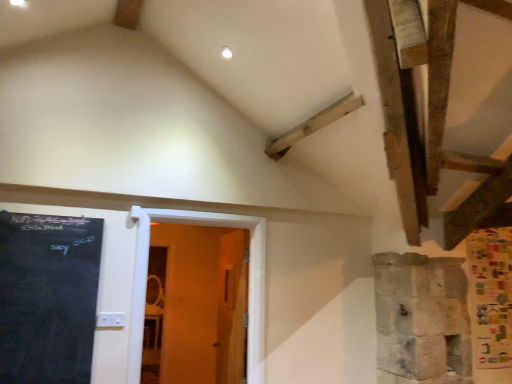
Question: Is wooden door at center facing towards black chalkboard at left?

Choices:
 (A) no
 (B) yes

Answer: (A)

Question: Considering the relative sizes of wooden door at center and black chalkboard at left in the image provided, is wooden door at center bigger than black chalkboard at left?

Choices:
 (A) yes
 (B) no

Answer: (A)

Question: Is wooden door at center oriented away from black chalkboard at left?

Choices:
 (A) yes
 (B) no

Answer: (B)

Question: Is black chalkboard at left located within wooden door at center?

Choices:
 (A) no
 (B) yes

Answer: (A)

Question: From a real-world perspective, is wooden door at center physically below black chalkboard at left?

Choices:
 (A) no
 (B) yes

Answer: (B)

Question: From the image's perspective, is wooden door at center on black chalkboard at left?

Choices:
 (A) no
 (B) yes

Answer: (A)

Question: Can you confirm if black chalkboard at left is thinner than wooden door at center?

Choices:
 (A) no
 (B) yes

Answer: (B)

Question: Is black chalkboard at left shorter than wooden door at center?

Choices:
 (A) yes
 (B) no

Answer: (A)

Question: Does black chalkboard at left touch wooden door at center?

Choices:
 (A) no
 (B) yes

Answer: (A)

Question: Is black chalkboard at left further to the viewer compared to wooden door at center?

Choices:
 (A) yes
 (B) no

Answer: (B)

Question: Considering the relative sizes of black chalkboard at left and wooden door at center in the image provided, is black chalkboard at left wider than wooden door at center?

Choices:
 (A) no
 (B) yes

Answer: (A)

Question: Would you say black chalkboard at left contains wooden door at center?

Choices:
 (A) no
 (B) yes

Answer: (A)

Question: Is point (49, 243) closer or farther from the camera than point (252, 263)?

Choices:
 (A) farther
 (B) closer

Answer: (B)